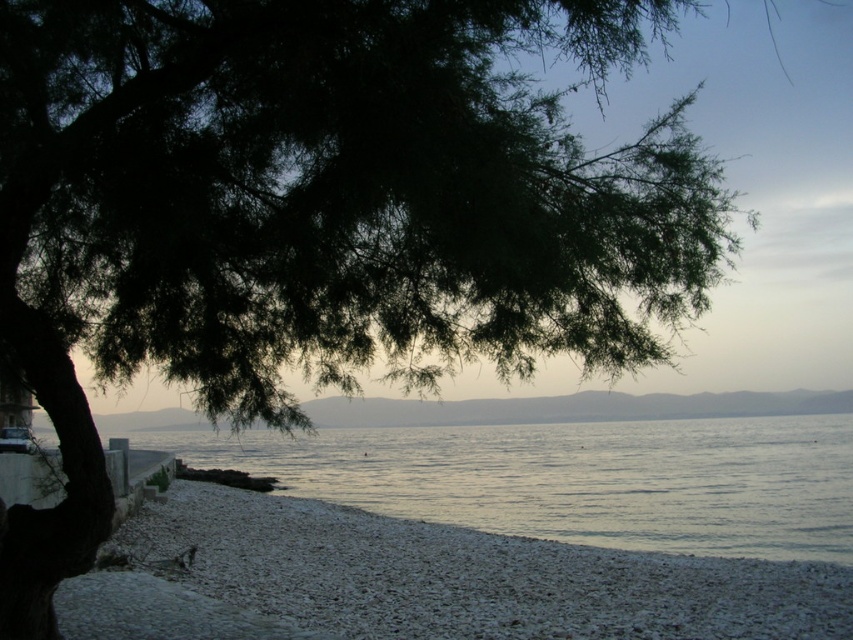
Question: Which of the following is the closest to the observer?

Choices:
 (A) clear water at center
 (B) gray gravel beach at lower left

Answer: (B)

Question: Can you confirm if gray gravel beach at lower left is bigger than clear water at center?

Choices:
 (A) no
 (B) yes

Answer: (A)

Question: Which object appears closest to the camera in this image?

Choices:
 (A) clear water at center
 (B) gray gravel beach at lower left

Answer: (B)

Question: Observing the image, what is the correct spatial positioning of gray gravel beach at lower left in reference to clear water at center?

Choices:
 (A) left
 (B) right

Answer: (A)

Question: Does gray gravel beach at lower left appear on the left side of clear water at center?

Choices:
 (A) yes
 (B) no

Answer: (A)